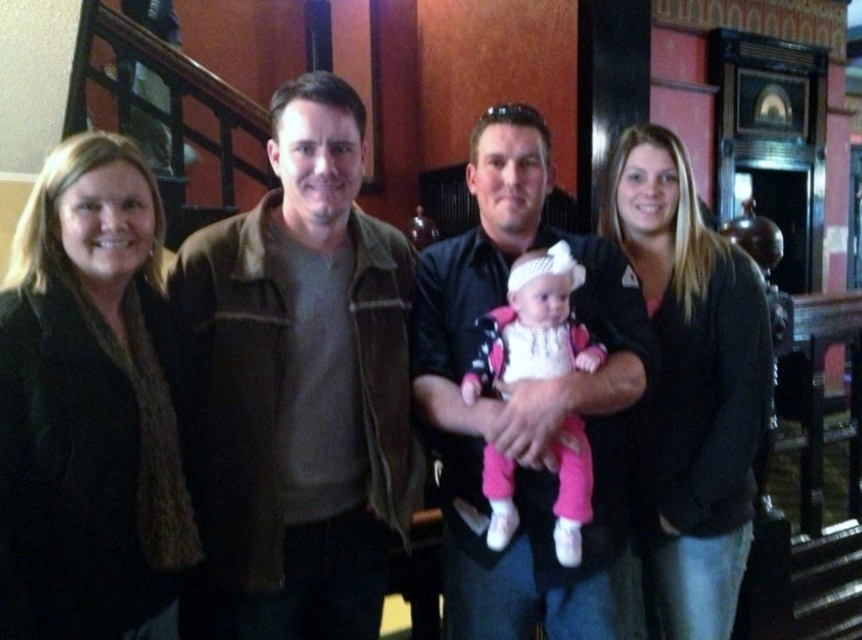
Question: Which object is farther from the camera taking this photo?

Choices:
 (A) pink fabric baby at center
 (B) matte black shirt at center
 (C) brown leather jacket at center

Answer: (A)

Question: Does black wool scarf at left have a smaller size compared to matte black shirt at center?

Choices:
 (A) no
 (B) yes

Answer: (B)

Question: Can you confirm if brown leather jacket at center is smaller than black sweater at center?

Choices:
 (A) no
 (B) yes

Answer: (B)

Question: Which point is farther from the camera taking this photo?

Choices:
 (A) (656, 467)
 (B) (490, 307)
 (C) (560, 362)
 (D) (127, 236)

Answer: (A)

Question: Does brown leather jacket at center appear under black sweater at center?

Choices:
 (A) no
 (B) yes

Answer: (A)

Question: Which of the following is the farthest from the observer?

Choices:
 (A) (110, 531)
 (B) (673, 214)
 (C) (322, 467)

Answer: (B)